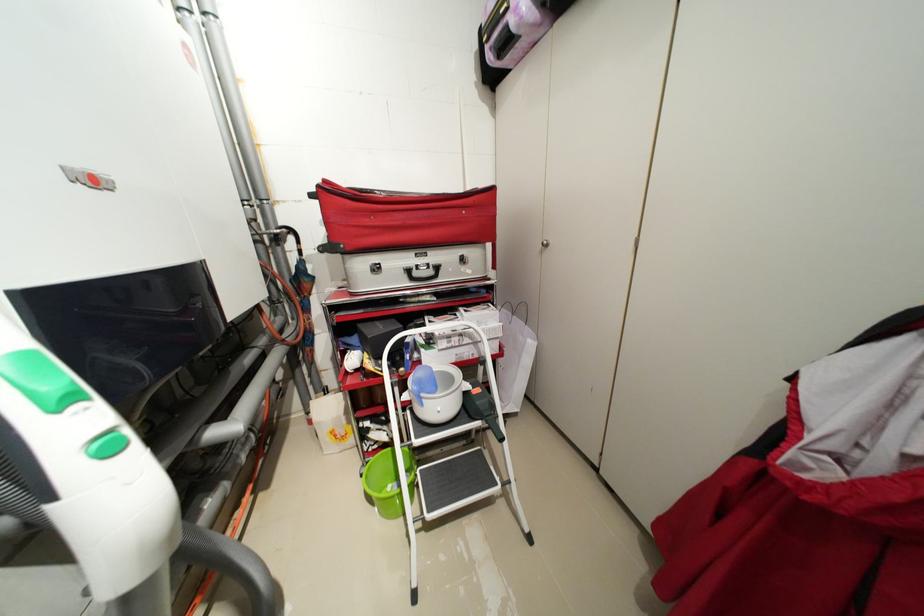
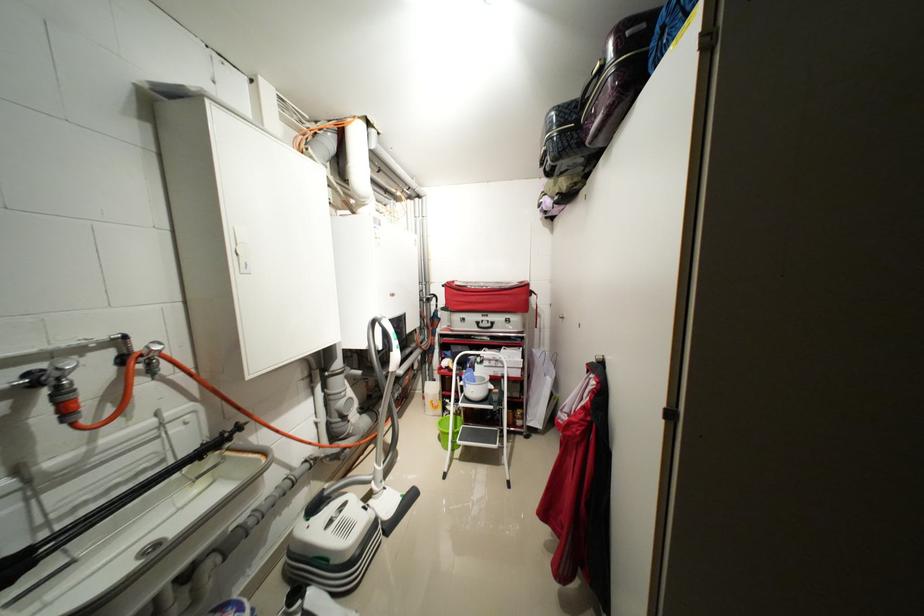
Question: I am providing you with two images of the same scene from different viewpoints. After the viewpoint changes to image2, which objects are now occluded?

Choices:
 (A) red suitcase
 (B) green bucket
 (C) black valve handle
 (D) none of these

Answer: (D)